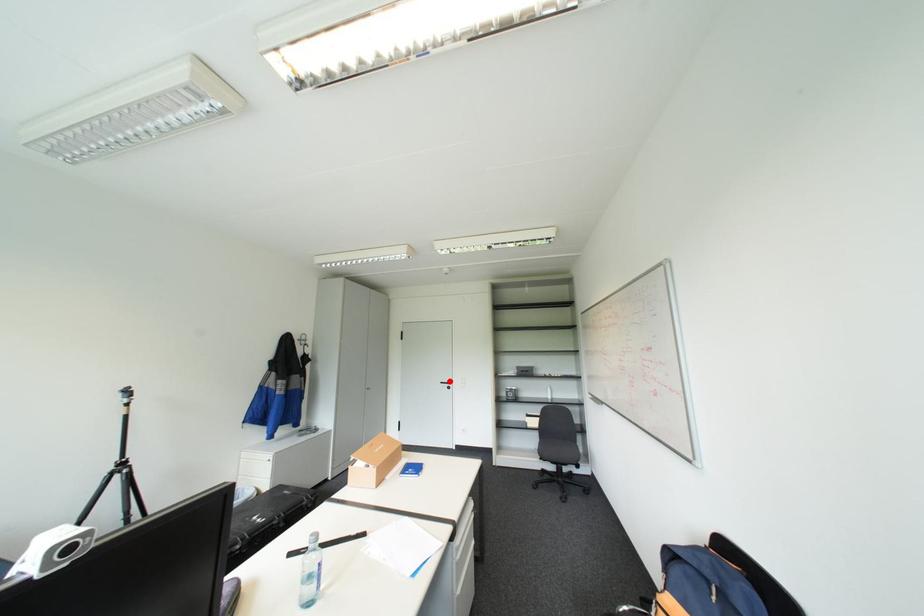
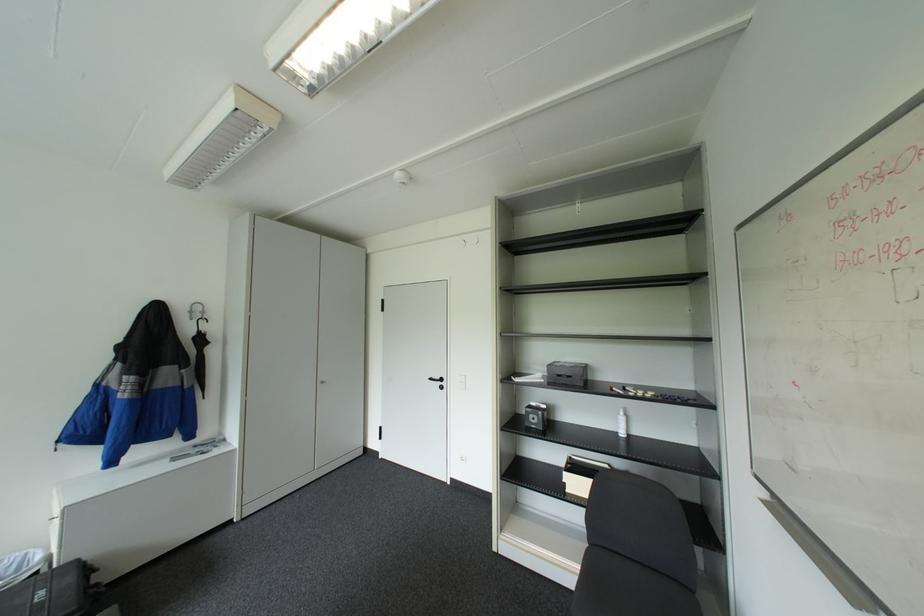
Locate, in the second image, the point that corresponds to the highlighted location in the first image.

(439, 378)